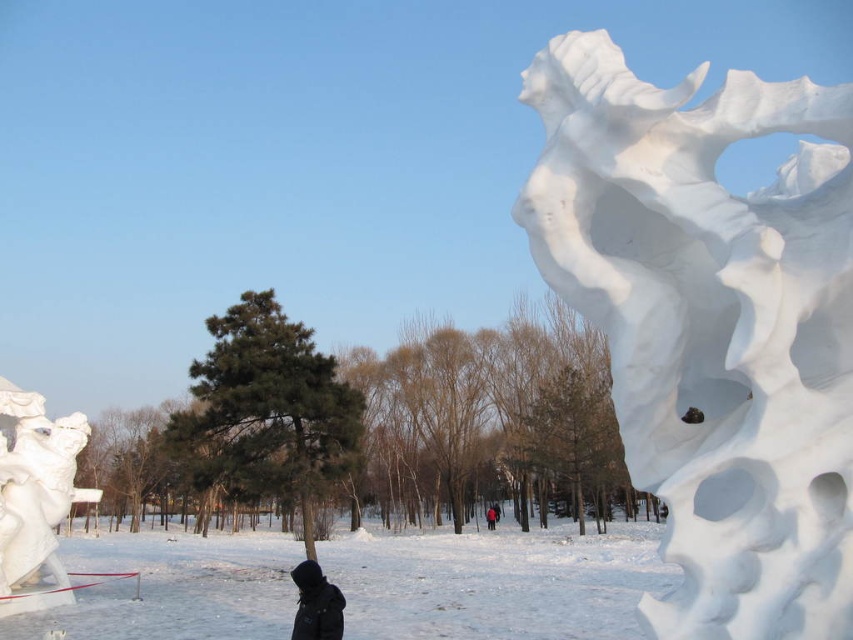
You are a photographer planning to take a photo of the black matte jacket at lower center and the white snow at lower center. You want to ensure both subjects are in focus. If your camera has a depth of field that can cover 18 meters, will you be able to capture both in focus?

The white snow at lower center is 17.55 meters from the black matte jacket at lower center. Since the distance between them is within the 18 meters depth of field, both subjects can be captured in focus.

You are a photographer trying to capture the white snow sculpture at upper right and the white glossy statue at lower left in the same frame. Based on their positions, which one would appear closer to the camera in your photo?

The white snow sculpture at upper right would appear closer to the camera because it is positioned in front of the white glossy statue at lower left.